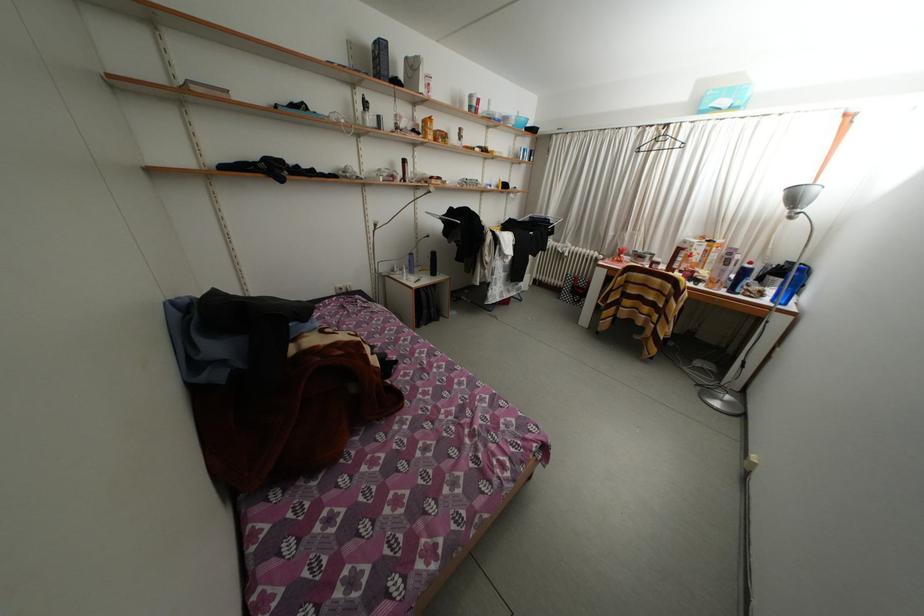
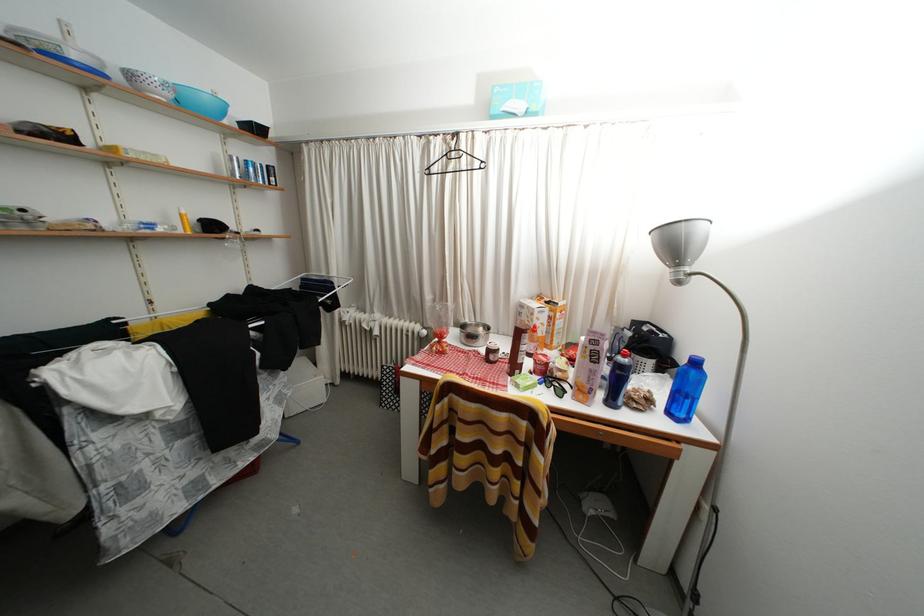
Locate, in the second image, the point that corresponds to the point at 634,262 in the first image.

(460, 342)